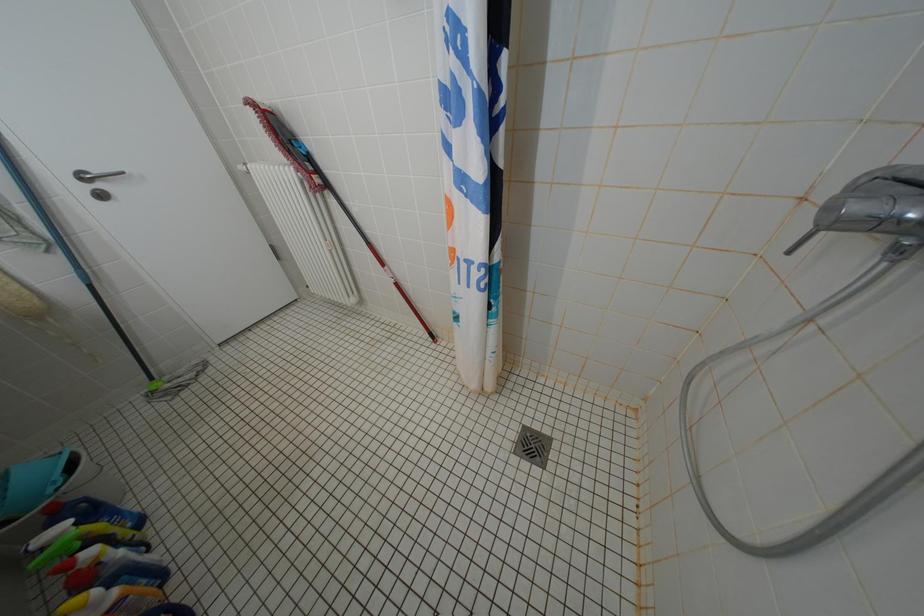
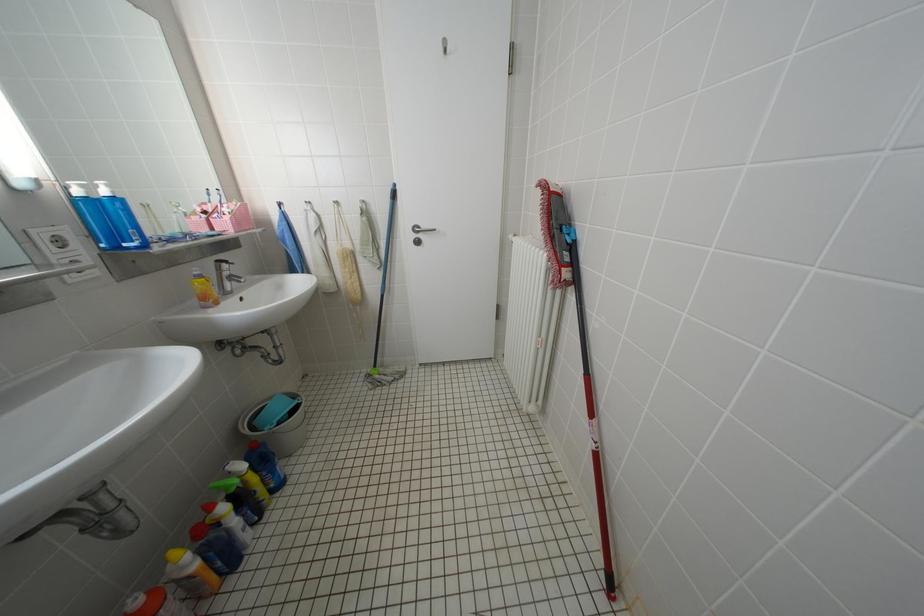
Question: The camera is either moving clockwise (left) or counter-clockwise (right) around the object. The first image is from the beginning of the video and the second image is from the end. Is the camera moving left or right when shooting the video?

Choices:
 (A) Left
 (B) Right

Answer: (B)